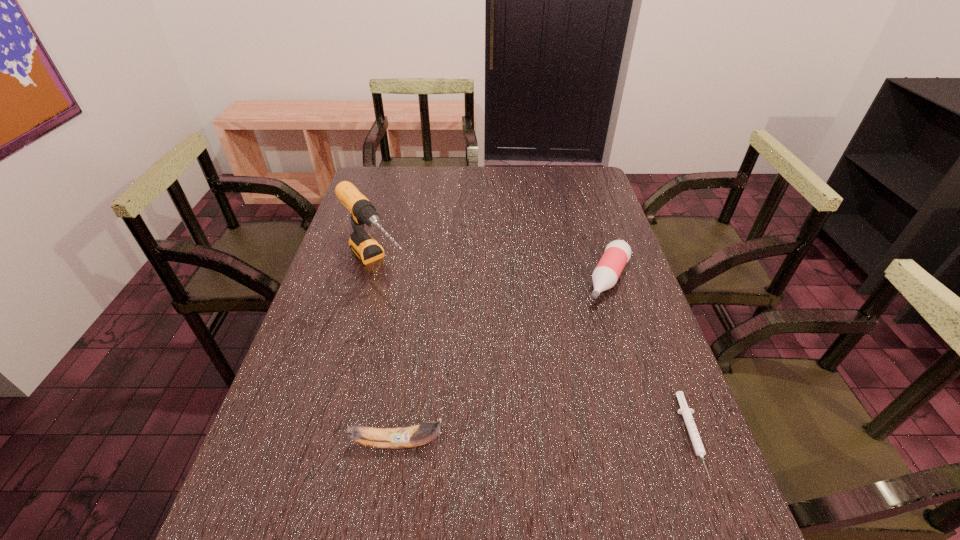
The height and width of the screenshot is (540, 960). What are the coordinates of `free space on the desktop that is between the third shortest object and the syringe and is positioned on the handle side of the drill` in the screenshot? It's located at (526, 440).

Where is `vacant space on the desktop that is between the banana and the shortest object and is positioned with the cap open on the third tallest object`? This screenshot has width=960, height=540. vacant space on the desktop that is between the banana and the shortest object and is positioned with the cap open on the third tallest object is located at coordinates (522, 440).